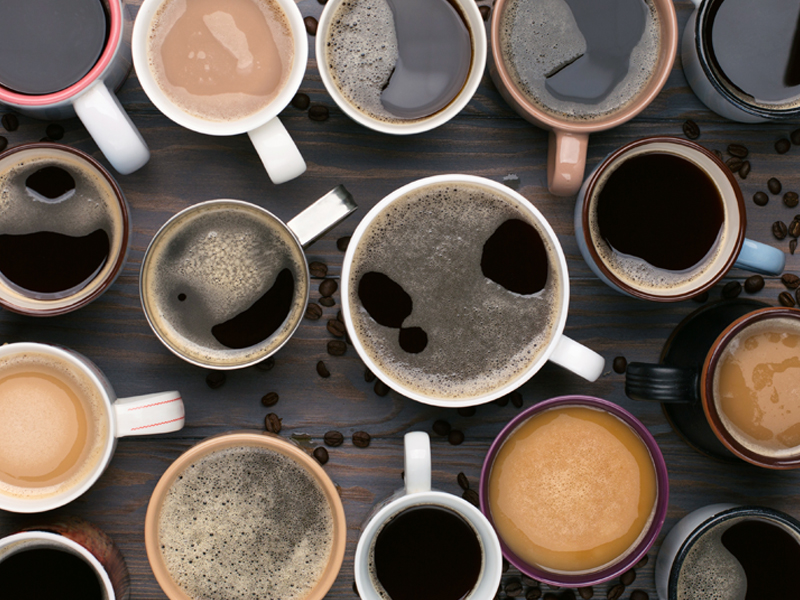
At what (x,y) coordinates should I click in order to perform the action: click on cup handles. Please return your answer as a coordinate pair (x, y). The width and height of the screenshot is (800, 600). Looking at the image, I should click on (101, 120), (269, 147), (565, 156), (750, 250), (578, 358), (646, 376), (328, 207), (164, 411), (414, 454).